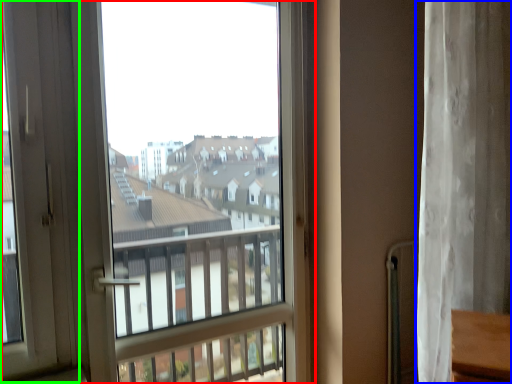
Question: Considering the real-world distances, which object is farthest from window (highlighted by a red box)? curtain (highlighted by a blue box) or screen door (highlighted by a green box)?

Choices:
 (A) curtain
 (B) screen door

Answer: (A)